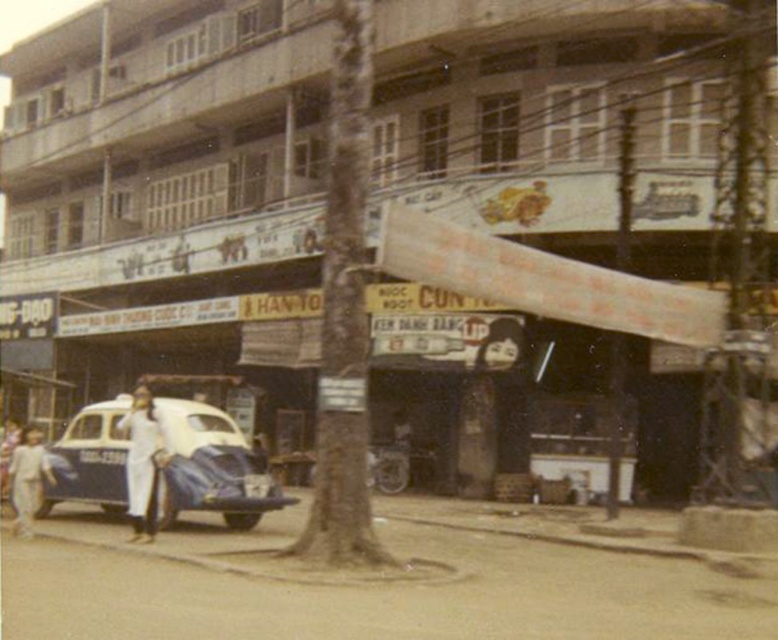
Looking at this image, you are a photographer analyzing an old street scene photo. The image has a tree trunk in the center and a vintage car on the left. You notice a detail labeled as dark hair at center. Based on its coordinates, where exactly is the dark hair located in the image?

The dark hair at center is located at the coordinates point (500, 342), which places it in the central area of the image.

You are standing on the street and see a person wearing white clothed person at lower left and light beige pants at lower left. Which one is positioned more to the right side?

The light beige pants at lower left is positioned to the right of the white clothed person at lower left.

You are a photographer trying to capture a clear shot of the dark hair at center and the white clothed person at lower left. Since the tree trunk is blocking part of the view, you want to adjust your position to ensure both subjects are fully visible. Based on their sizes, which subject might require more careful positioning to avoid being obscured?

The dark hair at center has a smaller width than the white clothed person at lower left, so it might require more careful positioning to avoid being obscured by the tree trunk since it is smaller and easier to block.